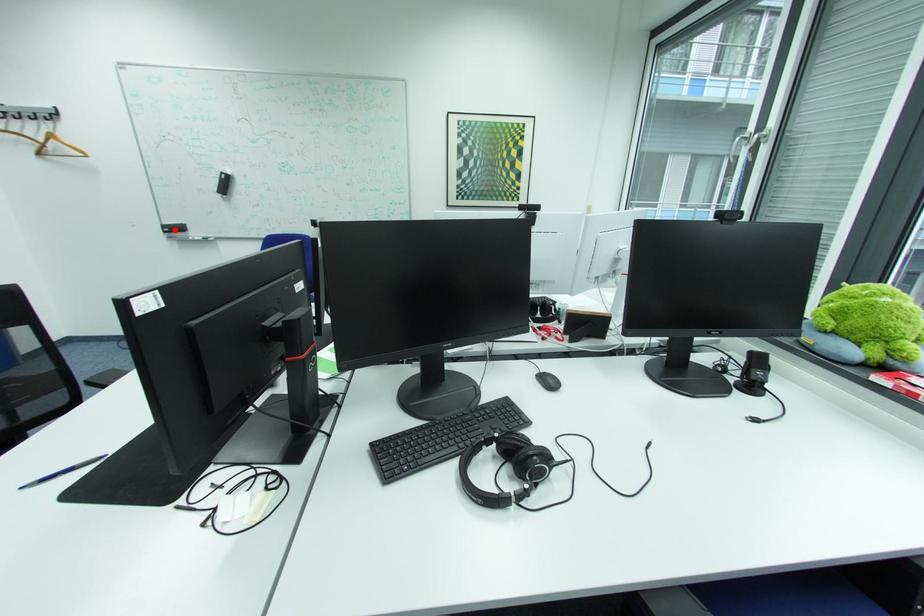
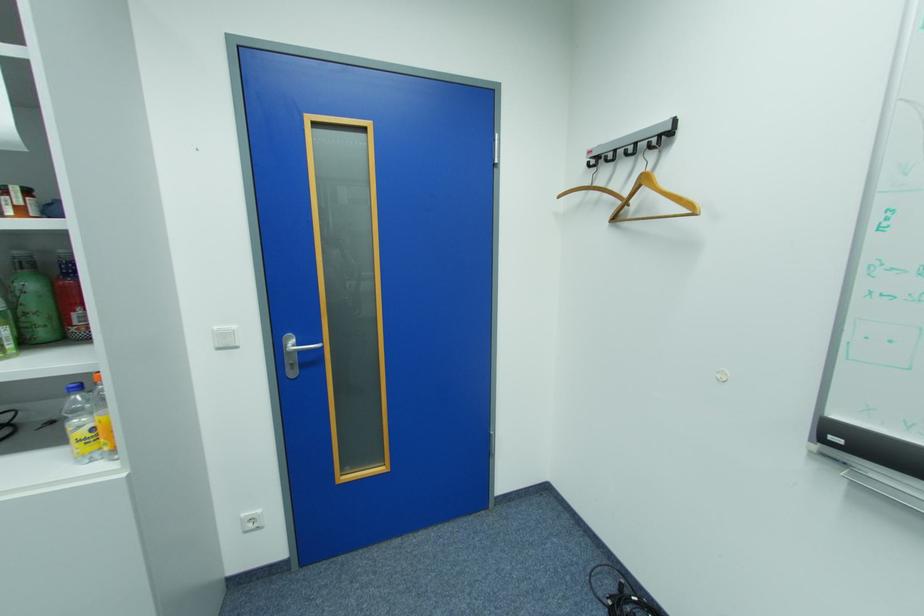
Find the pixel in the second image that matches the highlighted location in the first image.

(845, 440)